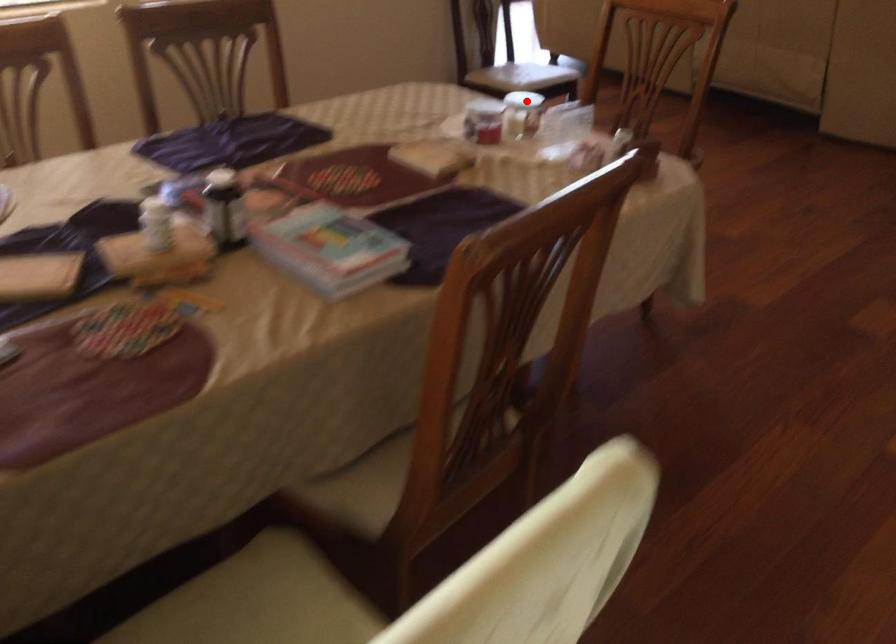
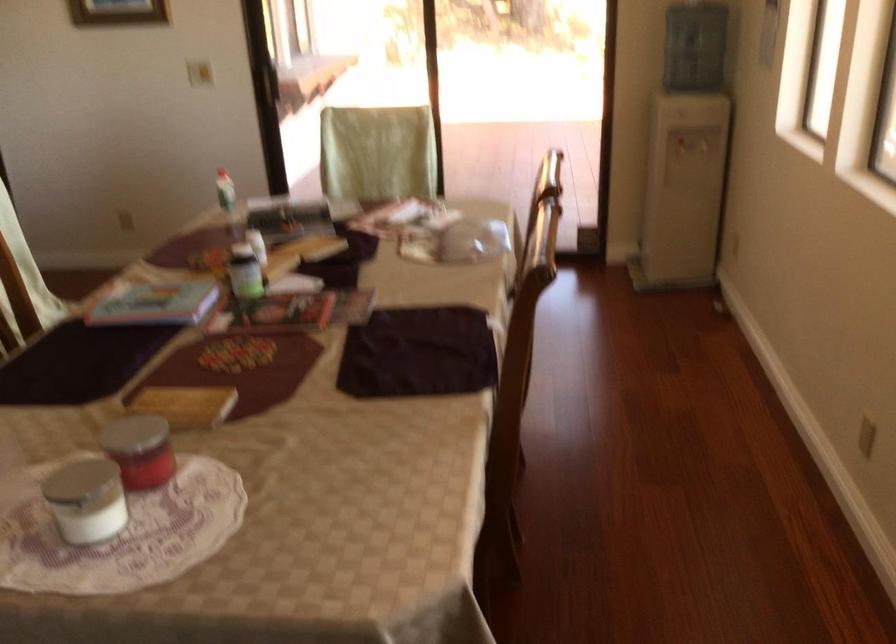
In the second image, find the point that corresponds to the highlighted location in the first image.

(85, 500)